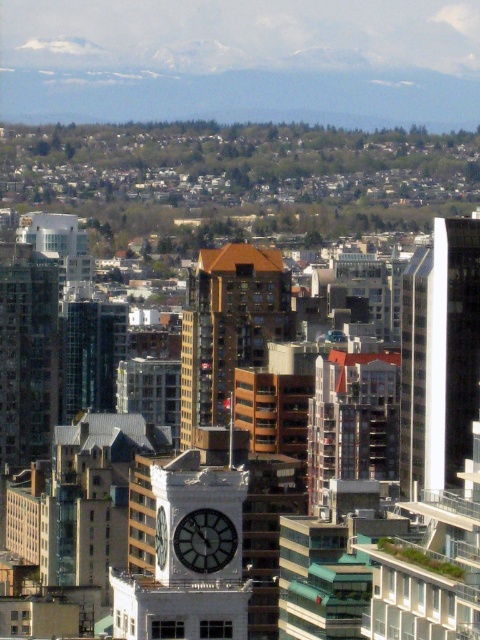
Is brown wood grain building at center further to the viewer compared to glassy reflective skyscraper at left?

No, it is in front of glassy reflective skyscraper at left.

Is brown wood grain building at center to the left of glassy reflective skyscraper at left from the viewer's perspective?

Incorrect, brown wood grain building at center is not on the left side of glassy reflective skyscraper at left.

Where is `brown wood grain building at center`? brown wood grain building at center is located at coordinates (228, 326).

Who is more forward, (239, 337) or (195, 564)?

Point (239, 337) is in front.

Is brown wood grain building at center smaller than metallic clock face at center?

No, brown wood grain building at center is not smaller than metallic clock face at center.

This screenshot has height=640, width=480. Identify the location of brown wood grain building at center. (228, 326).

The width and height of the screenshot is (480, 640). Identify the location of brown wood grain building at center. (228, 326).

Is white glass tower at right to the left of metallic clock face at center from the viewer's perspective?

No, white glass tower at right is not to the left of metallic clock face at center.

Can you confirm if white glass tower at right is bigger than metallic clock face at center?

Indeed, white glass tower at right has a larger size compared to metallic clock face at center.

What do you see at coordinates (440, 356) in the screenshot? The height and width of the screenshot is (640, 480). I see `white glass tower at right` at bounding box center [440, 356].

The width and height of the screenshot is (480, 640). Identify the location of white glass tower at right. (x=440, y=356).